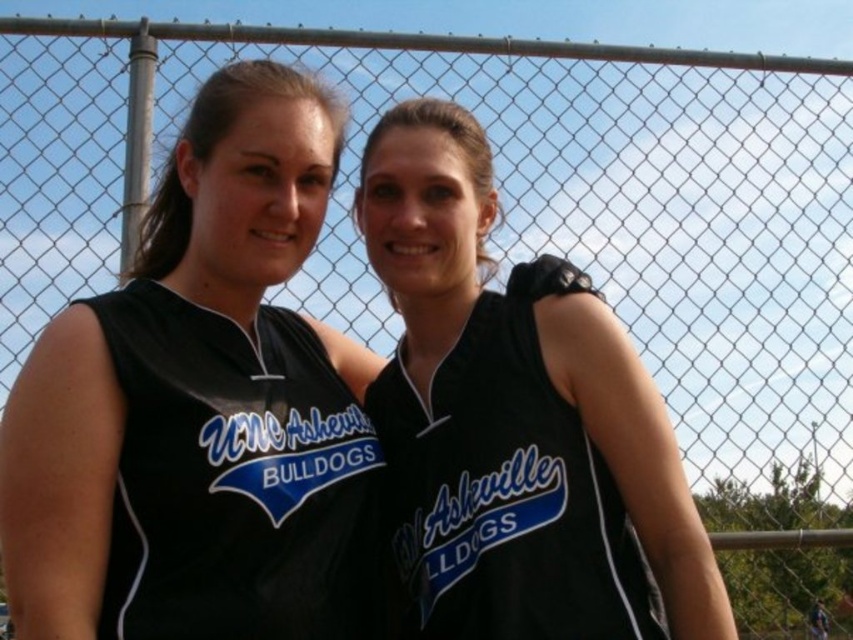
You are a photographer at the sports field. You want to capture a photo of the two players wearing black jerseys. The black jersey at left and the black jersey at center are positioned such that one is blocking the other. Which jersey is blocking the other?

The black jersey at left is blocking the black jersey at center because it is positioned in front of it.

You are a sports photographer trying to capture a candid shot of both players wearing the black jersey at left and the black jersey at center. Since you want to ensure both are in focus, you need to know which jersey is closer to the camera. Based on their sizes, can you determine which one is nearer?

The black jersey at left is thinner than the black jersey at center, which suggests it is farther away from the camera. Therefore, the black jersey at center is closer to the camera.

In the scene shown: You are a photographer positioned at the origin point of the image coordinate system. You want to take a photo of the black jersey at left. What are the coordinates where you should aim your camera?

The coordinates to aim the camera are at point (235, 477).